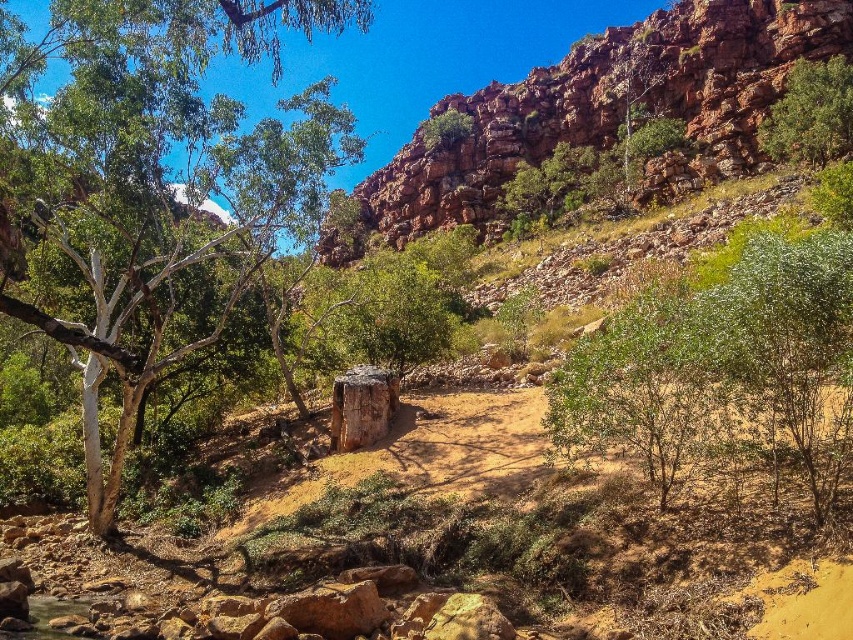
Question: Which object appears closest to the camera in this image?

Choices:
 (A) rusty rock cliff at upper right
 (B) green leafy tree at upper center

Answer: (A)

Question: Which is farther from the green leafy tree at left?

Choices:
 (A) rusty rock cliff at upper right
 (B) green leafy tree at upper right
 (C) green leafy tree at upper center
 (D) green leafy bush at lower right

Answer: (C)

Question: Does green leafy tree at left lie behind rusty rock cliff at upper right?

Choices:
 (A) yes
 (B) no

Answer: (B)

Question: Is green leafy bush at lower right positioned in front of green leafy tree at upper right?

Choices:
 (A) yes
 (B) no

Answer: (A)

Question: Which of the following is the farthest from the observer?

Choices:
 (A) green leafy bush at lower right
 (B) green leafy tree at left

Answer: (A)

Question: Is green leafy bush at lower right wider than green leafy tree at upper right?

Choices:
 (A) no
 (B) yes

Answer: (B)